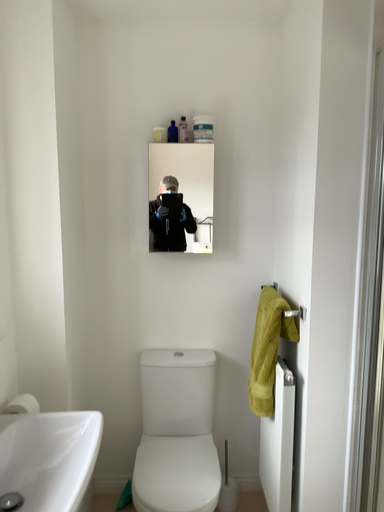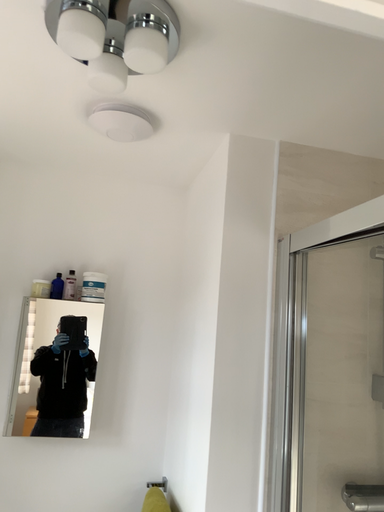
Question: Which way did the camera rotate in the video?

Choices:
 (A) rotated upward
 (B) rotated downward

Answer: (A)